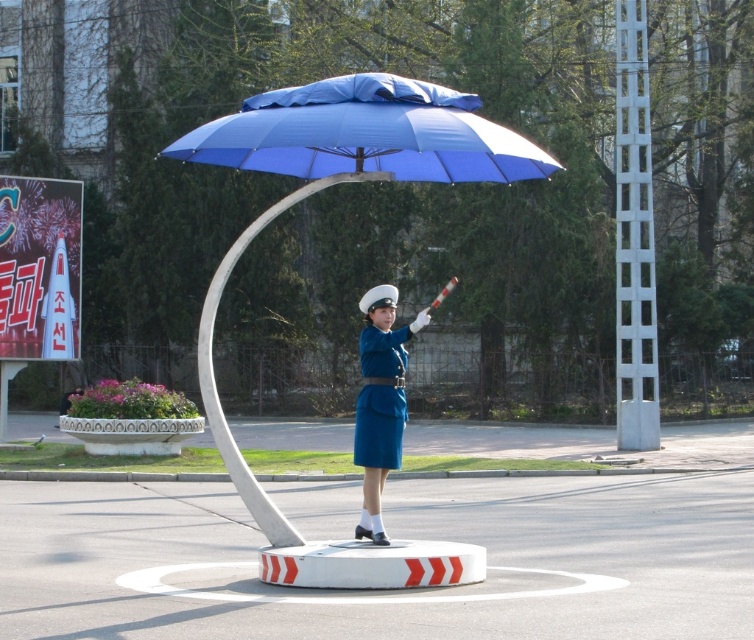
Is point (323, 129) positioned in front of point (374, 513)?

Yes.

Is blue matte umbrella at center closer to the viewer compared to blue fabric uniform at center?

Yes, it is in front of blue fabric uniform at center.

Is point (379, 132) positioned before point (388, 392)?

That is True.

Where is `blue matte umbrella at center`? blue matte umbrella at center is located at coordinates (342, 180).

Is blue fabric uniform at center above blue matte uniform at center?

Yes, blue fabric uniform at center is above blue matte uniform at center.

Between blue fabric uniform at center and blue matte uniform at center, which one is positioned lower?

blue matte uniform at center is below.

Is point (372, 336) positioned before point (379, 426)?

Yes.

This screenshot has width=754, height=640. What are the coordinates of `blue fabric uniform at center` in the screenshot? It's located at pyautogui.click(x=379, y=401).

Who is more forward, (336, 179) or (641, 387)?

Point (336, 179)

Is point (489, 136) closer to camera compared to point (624, 358)?

That is True.

This screenshot has height=640, width=754. What are the coordinates of `blue matte umbrella at center` in the screenshot? It's located at (342, 180).